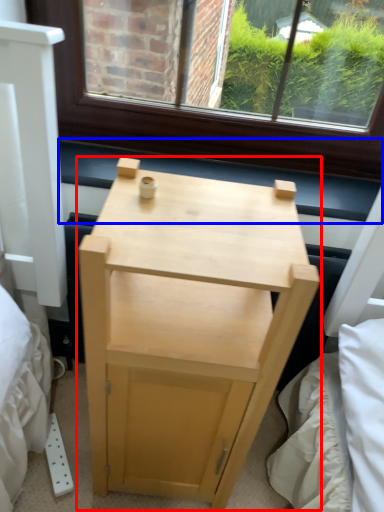
Question: Which object appears closest to the camera in this image, nightstand (highlighted by a red box) or window sill (highlighted by a blue box)?

Choices:
 (A) nightstand
 (B) window sill

Answer: (A)